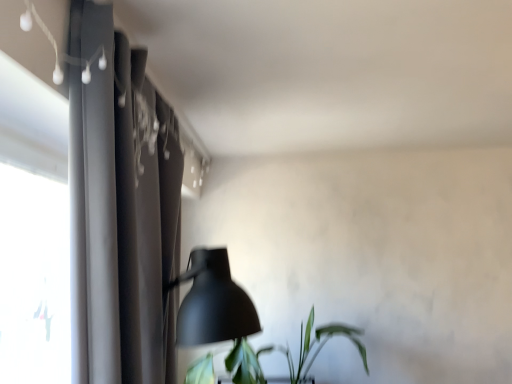
Describe the element at coordinates (288, 353) in the screenshot. I see `green leafy plant at lower right` at that location.

Measure the distance between green leafy plant at lower right and camera.

green leafy plant at lower right is 2.02 meters away from camera.

At what (x,y) coordinates should I click in order to perform the action: click on green leafy plant at lower right. Please return your answer as a coordinate pair (x, y). This screenshot has width=512, height=384. Looking at the image, I should click on (288, 353).

In the scene shown: In order to face green leafy plant at lower right, should I rotate leftwards or rightwards?

Rotate right and turn 2.932 degrees.

Locate an element on the screen. dark gray fabric curtain at left is located at coordinates (113, 218).

Describe the element at coordinates (113, 218) in the screenshot. I see `dark gray fabric curtain at left` at that location.

At what (x,y) coordinates should I click in order to perform the action: click on green leafy plant at lower right. Please return your answer as a coordinate pair (x, y). Image resolution: width=512 pixels, height=384 pixels. Looking at the image, I should click on (288, 353).

Would you say dark gray fabric curtain at left is to the left or to the right of green leafy plant at lower right in the picture?

Based on their positions, dark gray fabric curtain at left is located to the left of green leafy plant at lower right.

Considering the relative positions of dark gray fabric curtain at left and green leafy plant at lower right in the image provided, is dark gray fabric curtain at left behind green leafy plant at lower right?

No, the depth of dark gray fabric curtain at left is less than that of green leafy plant at lower right.

Is point (100, 376) in front of point (255, 352)?

Yes, point (100, 376) is closer to viewer.

From the image's perspective, would you say dark gray fabric curtain at left is shown under green leafy plant at lower right?

No, from the image's perspective, dark gray fabric curtain at left is not below green leafy plant at lower right.

From a real-world perspective, is dark gray fabric curtain at left beneath green leafy plant at lower right?

Incorrect, from a real-world perspective, dark gray fabric curtain at left is higher than green leafy plant at lower right.

Which of these two, dark gray fabric curtain at left or green leafy plant at lower right, is thinner?

dark gray fabric curtain at left.

In terms of height, does dark gray fabric curtain at left look taller or shorter compared to green leafy plant at lower right?

Considering their sizes, dark gray fabric curtain at left has more height than green leafy plant at lower right.

Can you confirm if dark gray fabric curtain at left is bigger than green leafy plant at lower right?

No.

Does dark gray fabric curtain at left contain green leafy plant at lower right?

No, green leafy plant at lower right is not inside dark gray fabric curtain at left.

Does dark gray fabric curtain at left touch green leafy plant at lower right?

No, dark gray fabric curtain at left is not with green leafy plant at lower right.

Is green leafy plant at lower right at the back of dark gray fabric curtain at left?

No.

How many degrees apart are the facing directions of dark gray fabric curtain at left and green leafy plant at lower right?

The angular difference between dark gray fabric curtain at left and green leafy plant at lower right is 86.9 degrees.

Image resolution: width=512 pixels, height=384 pixels. What are the coordinates of `houseplant directly beneath the dark gray fabric curtain at left (from a real-world perspective)` in the screenshot? It's located at (288, 353).

Between green leafy plant at lower right and dark gray fabric curtain at left, which one appears on the right side from the viewer's perspective?

green leafy plant at lower right.

Which object is further away from the camera, green leafy plant at lower right or dark gray fabric curtain at left?

green leafy plant at lower right is behind.

Considering the points (257, 375) and (134, 291), which point is behind, point (257, 375) or point (134, 291)?

The point (257, 375) is farther.

From the image's perspective, does green leafy plant at lower right appear lower than dark gray fabric curtain at left?

Correct, green leafy plant at lower right appears lower than dark gray fabric curtain at left in the image.

From a real-world perspective, is green leafy plant at lower right located beneath dark gray fabric curtain at left?

Yes, from a real-world perspective, green leafy plant at lower right is under dark gray fabric curtain at left.

Is green leafy plant at lower right thinner than dark gray fabric curtain at left?

No.

In terms of height, does green leafy plant at lower right look taller or shorter compared to dark gray fabric curtain at left?

In the image, green leafy plant at lower right appears to be shorter than dark gray fabric curtain at left.

Consider the image. Can you confirm if green leafy plant at lower right is bigger than dark gray fabric curtain at left?

Yes, green leafy plant at lower right is bigger than dark gray fabric curtain at left.

Is dark gray fabric curtain at left located within green leafy plant at lower right?

That's incorrect, dark gray fabric curtain at left is not inside green leafy plant at lower right.

Would you say green leafy plant at lower right is a long distance from dark gray fabric curtain at left?

green leafy plant at lower right is positioned a significant distance from dark gray fabric curtain at left.

Is green leafy plant at lower right turned away from dark gray fabric curtain at left?

That's not correct — green leafy plant at lower right is not looking away from dark gray fabric curtain at left.

Based on the photo, what's the angular difference between green leafy plant at lower right and dark gray fabric curtain at left's facing directions?

There is a 86.9-degree angle between the facing directions of green leafy plant at lower right and dark gray fabric curtain at left.

This screenshot has height=384, width=512. In the image, there is a dark gray fabric curtain at left. What are the coordinates of `houseplant below it (from a real-world perspective)` in the screenshot? It's located at (288, 353).

Where is `curtain above the green leafy plant at lower right (from the image's perspective)`? This screenshot has height=384, width=512. curtain above the green leafy plant at lower right (from the image's perspective) is located at coordinates (113, 218).

At what (x,y) coordinates should I click in order to perform the action: click on houseplant that is behind the dark gray fabric curtain at left. Please return your answer as a coordinate pair (x, y). This screenshot has width=512, height=384. Looking at the image, I should click on tap(288, 353).